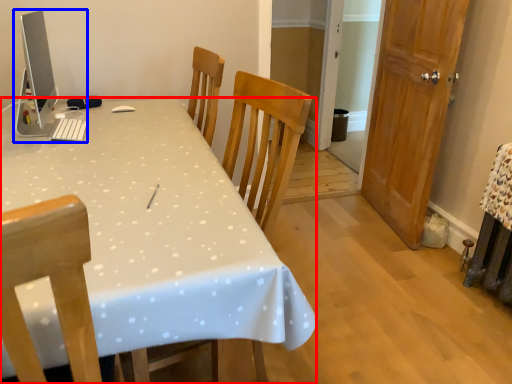
Question: Which object appears farthest to the camera in this image, desk (highlighted by a red box) or desktop computer (highlighted by a blue box)?

Choices:
 (A) desk
 (B) desktop computer

Answer: (B)